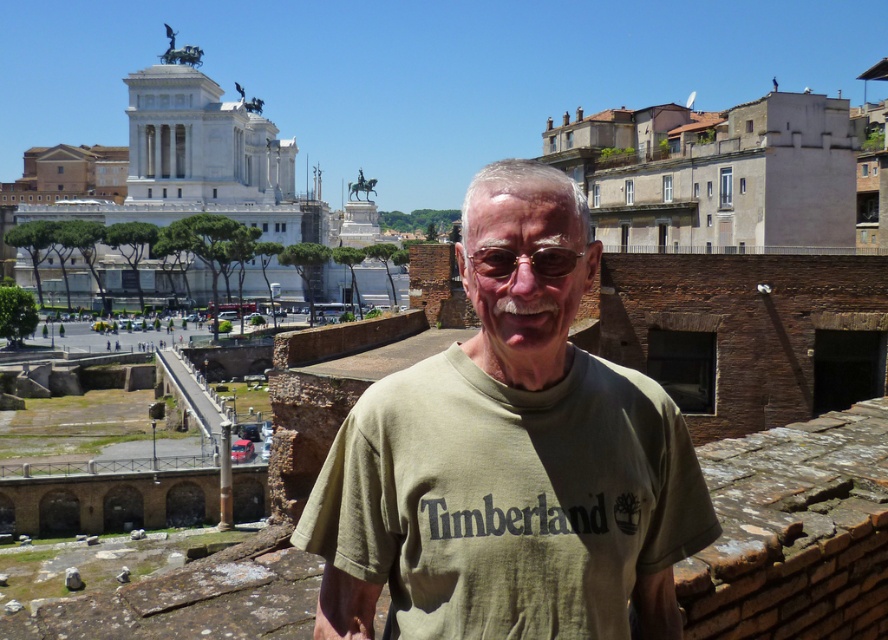
Based on the photo, you are a photographer trying to capture the man in the scene. The green cotton shirt at center and gold metallic glasses at center are both visible in your frame. If you want to ensure both objects are clearly visible, which one should you focus on first?

The green cotton shirt at center is larger in size than the gold metallic glasses at center, so you should focus on the green cotton shirt at center first to ensure proper focus and clarity for both objects.

You are a photographer taking a picture of the man wearing the green cotton shirt at center and gold metallic glasses at center. Which object is more to the left in the image?

The green cotton shirt at center is positioned on the left side of gold metallic glasses at center, so it is more to the left.